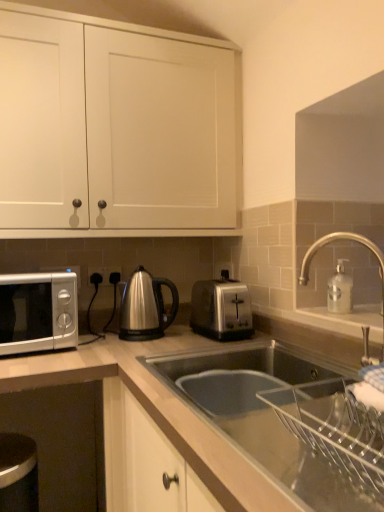
Question: From a real-world perspective, is white matte cabinet doors at upper center located higher than stainless steel kettle at center?

Choices:
 (A) no
 (B) yes

Answer: (B)

Question: Could stainless steel kettle at center be considered to be inside white matte cabinet doors at upper center?

Choices:
 (A) yes
 (B) no

Answer: (B)

Question: Is white matte cabinet doors at upper center wider than stainless steel kettle at center?

Choices:
 (A) no
 (B) yes

Answer: (B)

Question: Is white matte cabinet doors at upper center behind stainless steel kettle at center?

Choices:
 (A) yes
 (B) no

Answer: (B)

Question: Considering the relative sizes of white matte cabinet doors at upper center and stainless steel kettle at center in the image provided, is white matte cabinet doors at upper center bigger than stainless steel kettle at center?

Choices:
 (A) no
 (B) yes

Answer: (B)

Question: From the image's perspective, is white matte cabinet doors at upper center above or below satin silver outlet at center, placed as the second electric outlet when sorted from right to left?

Choices:
 (A) below
 (B) above

Answer: (B)

Question: Is white matte cabinet doors at upper center taller or shorter than satin silver outlet at center, placed as the second electric outlet when sorted from right to left?

Choices:
 (A) short
 (B) tall

Answer: (B)

Question: Relative to satin silver outlet at center, which is the 1th electric outlet in left-to-right order, is white matte cabinet doors at upper center in front or behind?

Choices:
 (A) front
 (B) behind

Answer: (A)

Question: Based on their sizes in the image, would you say white matte cabinet doors at upper center is bigger or smaller than satin silver outlet at center, which is the 1th electric outlet in left-to-right order?

Choices:
 (A) big
 (B) small

Answer: (A)

Question: From their relative heights in the image, would you say white matte cabinet doors at upper center is taller or shorter than satin silver toaster at center?

Choices:
 (A) tall
 (B) short

Answer: (B)

Question: Looking at the image, does white matte cabinet doors at upper center seem bigger or smaller compared to satin silver toaster at center?

Choices:
 (A) big
 (B) small

Answer: (B)

Question: Considering the positions of white matte cabinet doors at upper center and satin silver toaster at center in the image, is white matte cabinet doors at upper center wider or thinner than satin silver toaster at center?

Choices:
 (A) thin
 (B) wide

Answer: (A)

Question: Is point (231, 187) closer or farther from the camera than point (342, 510)?

Choices:
 (A) farther
 (B) closer

Answer: (A)

Question: From a real-world perspective, is stainless steel kettle at center positioned above or below satin silver toaster at center?

Choices:
 (A) below
 (B) above

Answer: (B)

Question: Which is correct: stainless steel kettle at center is inside satin silver toaster at center, or outside of it?

Choices:
 (A) outside
 (B) inside

Answer: (A)